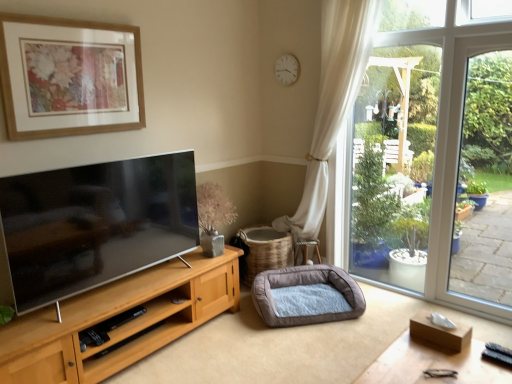
I want to click on free point above wooden picture frame at upper left (from a real-world perspective), so click(71, 17).